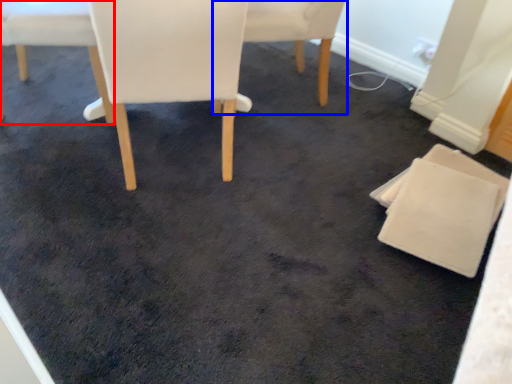
Question: Which point is closer to the camera, chair (highlighted by a red box) or chair (highlighted by a blue box)?

Choices:
 (A) chair
 (B) chair

Answer: (A)